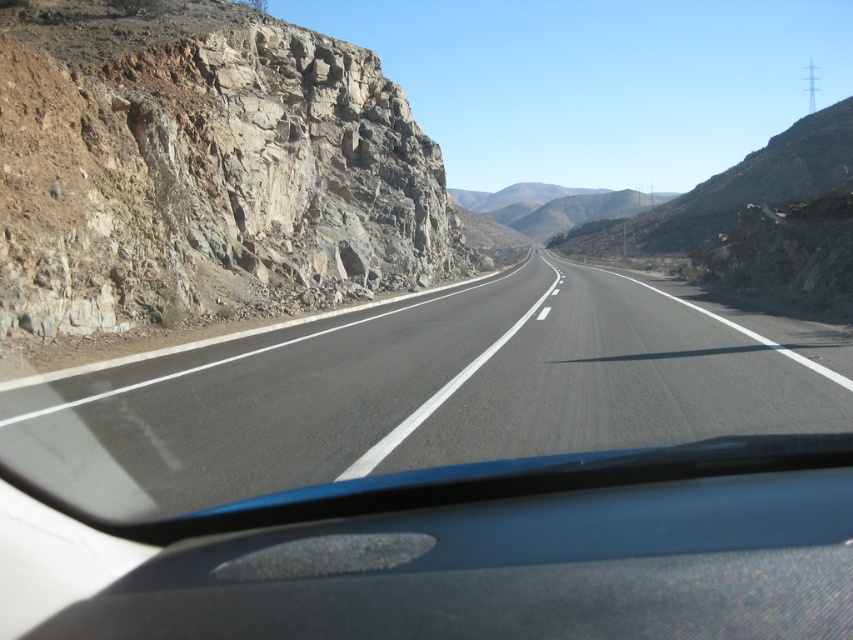
Question: Which of the following is the farthest from the observer?

Choices:
 (A) (730, 365)
 (B) (286, 294)

Answer: (B)

Question: Does rocky cliff at left appear on the left side of black asphalt road at center?

Choices:
 (A) yes
 (B) no

Answer: (A)

Question: Can you confirm if rocky cliff at left is positioned to the left of black asphalt road at center?

Choices:
 (A) no
 (B) yes

Answer: (B)

Question: Does rocky cliff at left appear on the left side of black asphalt road at center?

Choices:
 (A) yes
 (B) no

Answer: (A)

Question: Which of the following is the closest to the observer?

Choices:
 (A) (346, 211)
 (B) (38, 460)

Answer: (B)